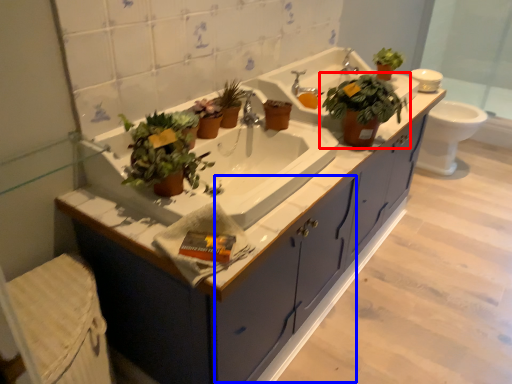
Question: Among these objects, which one is farthest to the camera, houseplant (highlighted by a red box) or drawer (highlighted by a blue box)?

Choices:
 (A) houseplant
 (B) drawer

Answer: (B)